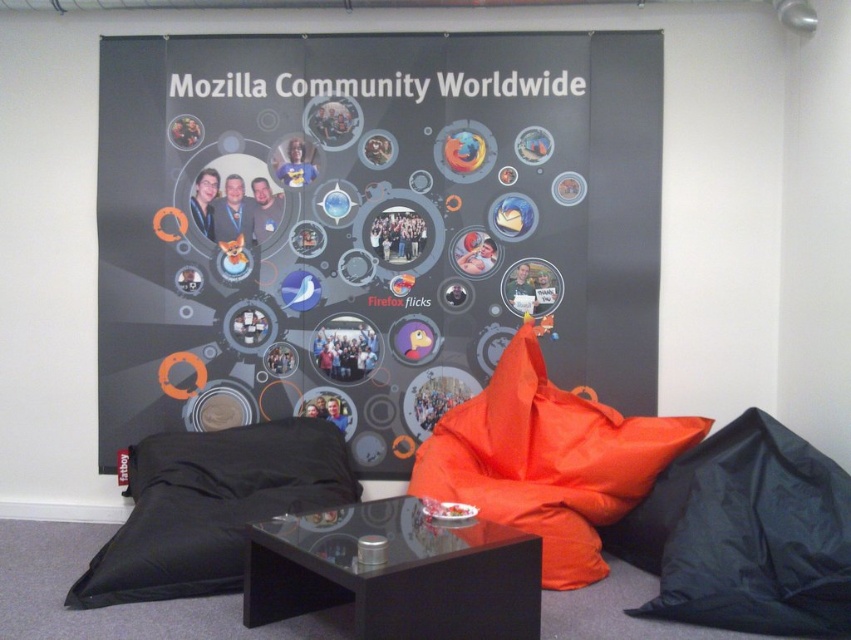
You are sitting on the orange fabric bean bag at center and want to pick up the black fabric pillow at lower left. Can you reach it without moving from your current position?

The black fabric pillow at lower left is behind the orange fabric bean bag at center, so you cannot reach it without moving from your current position.

You are standing at the origin point of the coordinate system in this image. You want to move towards the black fabric beanbag at lower right. What direction should you move in?

Since the black fabric beanbag at lower right is located at coordinate point (745, 534), you should move towards the lower right direction to reach it.

You are organizing a Mozilla event and need to place a decorative item on a table. You have both the matte black poster at center and the black fabric pillow at lower left. Which item should you choose if you want something larger to catch attendees attention?

The matte black poster at center has a larger size compared to the black fabric pillow at lower left, so it would be better to choose the matte black poster at center to catch attendees attention.